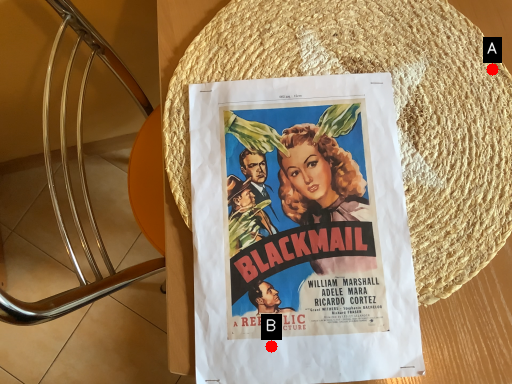
Question: Two points are circled on the image, labeled by A and B beside each circle. Which point is farther to the camera?

Choices:
 (A) A is further
 (B) B is further

Answer: (A)